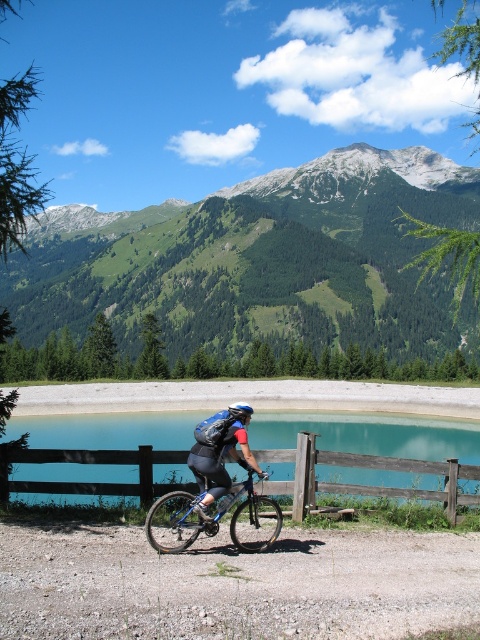
Which of these two, wooden at center or blue metallic bicycle at center, stands shorter?

With less height is blue metallic bicycle at center.

Who is higher up, wooden at center or blue metallic bicycle at center?

blue metallic bicycle at center is higher up.

Locate an element on the screen. This screenshot has height=640, width=480. wooden at center is located at coordinates (96, 464).

Image resolution: width=480 pixels, height=640 pixels. Find the location of `wooden at center`. wooden at center is located at coordinates (96, 464).

Can you confirm if green forested mountain at upper center is positioned below wooden at center?

Actually, green forested mountain at upper center is above wooden at center.

Who is positioned more to the left, green forested mountain at upper center or wooden at center?

wooden at center

Who is more forward, (205, 316) or (19, 481)?

Positioned in front is point (19, 481).

Find the location of a particular element. The width and height of the screenshot is (480, 640). green forested mountain at upper center is located at coordinates (256, 260).

Who is higher up, dirt gravel at lower center or blue metallic bicycle at center?

blue metallic bicycle at center is higher up.

Between dirt gravel at lower center and blue metallic bicycle at center, which one has more height?

With more height is blue metallic bicycle at center.

The width and height of the screenshot is (480, 640). I want to click on dirt gravel at lower center, so click(x=236, y=582).

Locate an element on the screen. dirt gravel at lower center is located at coordinates (236, 582).